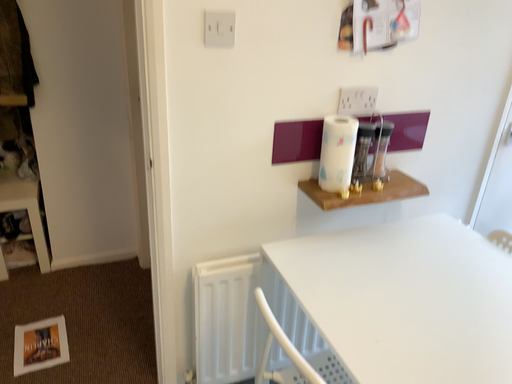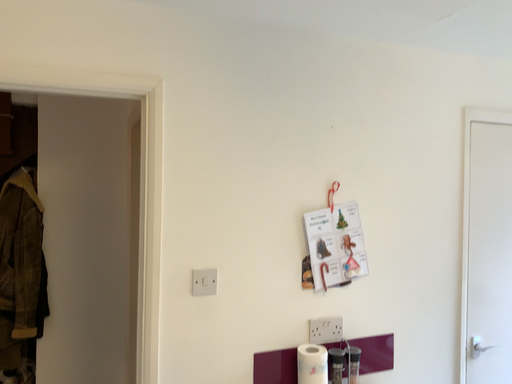
Question: How did the camera likely rotate when shooting the video?

Choices:
 (A) rotated downward
 (B) rotated upward

Answer: (B)